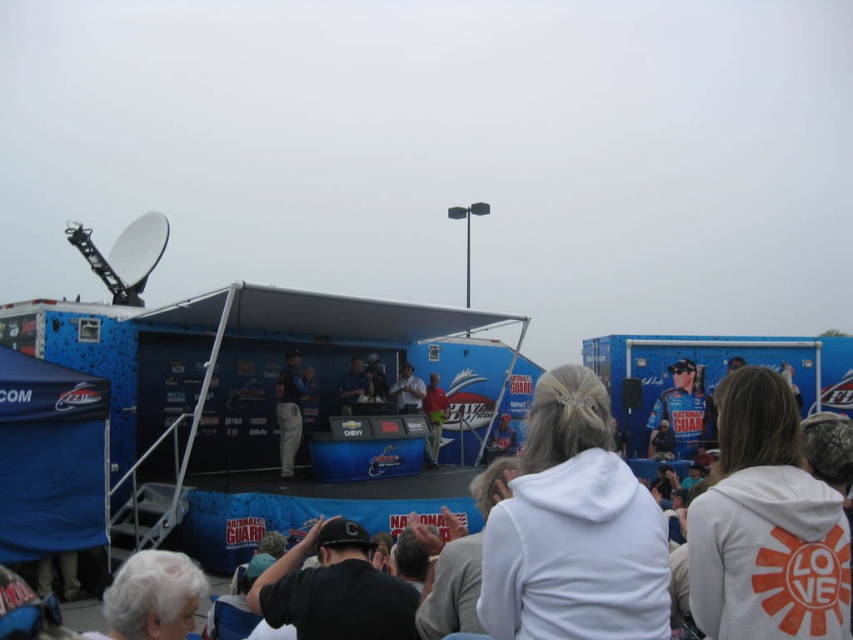
You are a drone operator tasked with capturing aerial footage of the event. The white fleece jacket at center and light gray fabric jacket at center are two landmarks you need to film simultaneously. Given that your drone camera has a maximum field of view of 30 meters, can you frame both jackets in a single shot?

The distance between the white fleece jacket at center and light gray fabric jacket at center is 28.99 meters. Since the drone camera can capture up to 30 meters in field of view, both jackets can be included in a single shot as the distance is within the limit.

You are a photographer at the event and need to capture both the white fleece jacket at center and the light gray fabric jacket at center in the same frame. Which jacket should you position closer to the left side of your camera viewfinder to include both?

To include both the white fleece jacket at center and the light gray fabric jacket at center in the same frame, position the light gray fabric jacket at center closer to the left side of your camera viewfinder since the white fleece jacket at center is to the right of it.

You are a photographer at the event and want to capture both the matte red shirt at center and the blue fabric shirt at center in the same frame. Which shirt should you focus on first to ensure both are in the shot?

The matte red shirt at center is positioned on the right side of blue fabric shirt at center. To capture both in the same frame, focus on the blue fabric shirt at center first as it is on the left, allowing the red shirt to naturally fall into the right side of the frame.